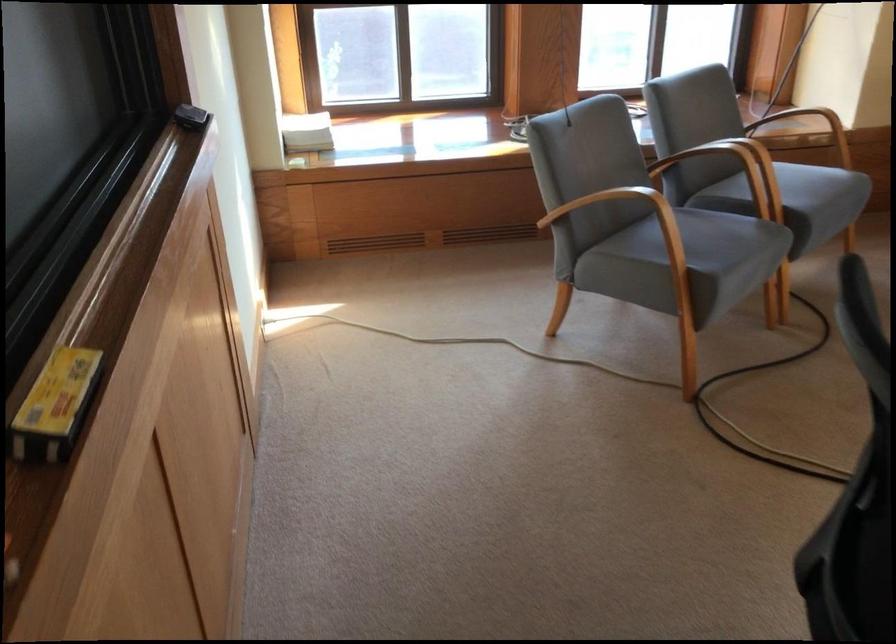
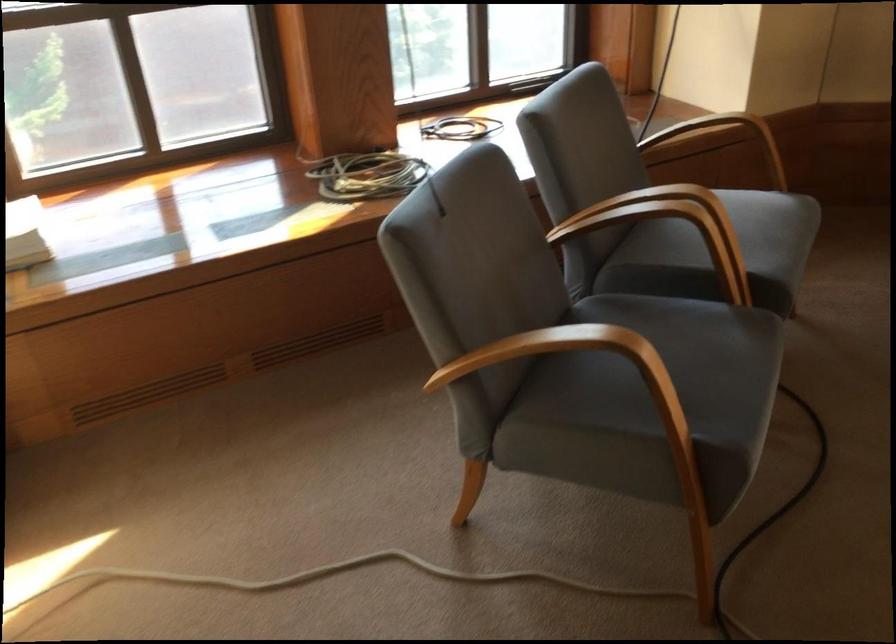
Locate, in the second image, the point that corresponds to (x=643, y=230) in the first image.

(591, 375)